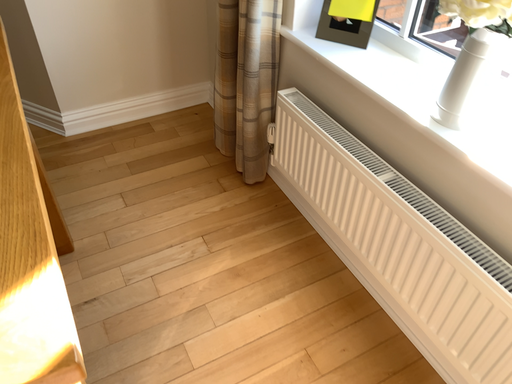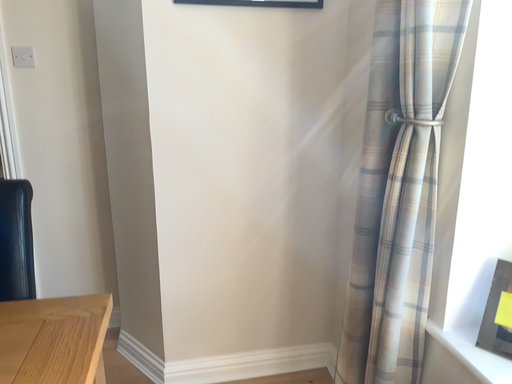
Question: Which way did the camera rotate in the video?

Choices:
 (A) rotated upward
 (B) rotated downward

Answer: (A)